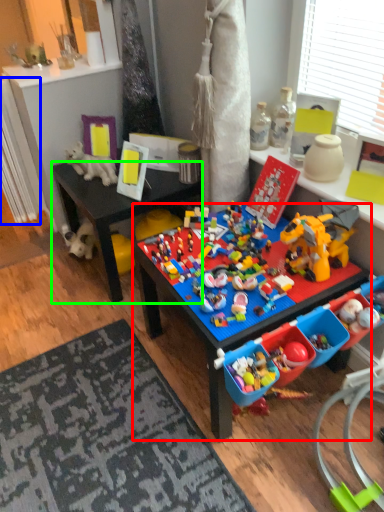
Question: Which object is positioned closest to table (highlighted by a red box)? Select from radiator (highlighted by a blue box) and desk (highlighted by a green box).

Choices:
 (A) radiator
 (B) desk

Answer: (B)